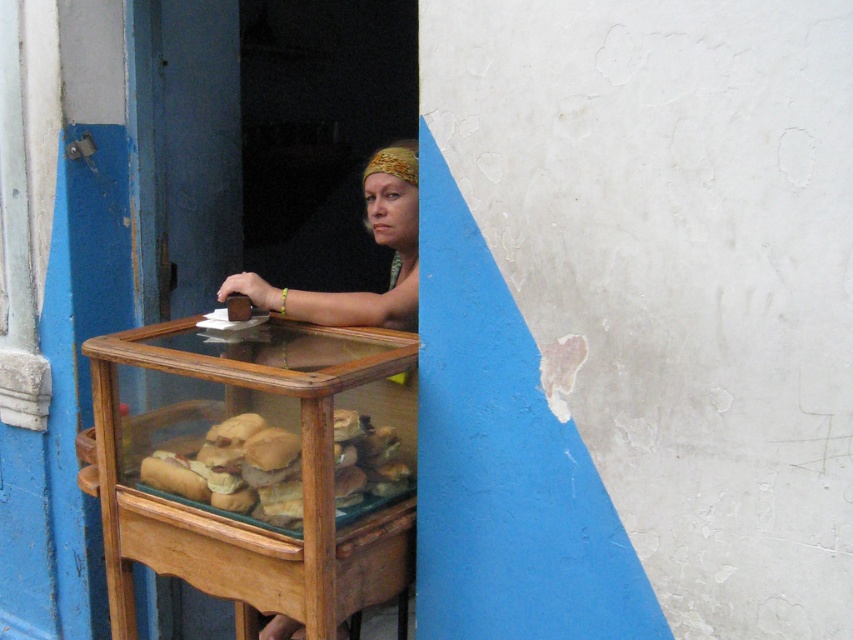
From the picture: Between golden brown bread at center and matte brown hair at center, which one is positioned lower?

golden brown bread at center is below.

Is golden brown bread at center above matte brown hair at center?

No.

Identify the location of golden brown bread at center. The height and width of the screenshot is (640, 853). (234, 472).

Image resolution: width=853 pixels, height=640 pixels. Identify the location of golden brown bread at center. (234, 472).